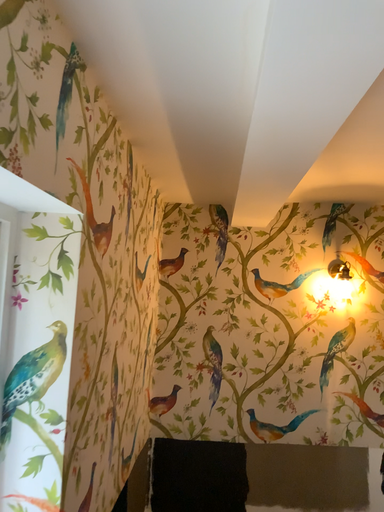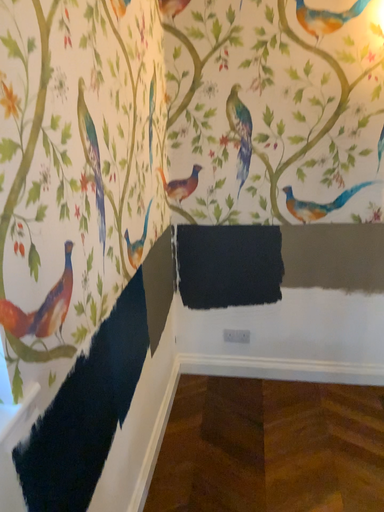
Question: How did the camera likely rotate when shooting the video?

Choices:
 (A) rotated upward
 (B) rotated downward

Answer: (B)